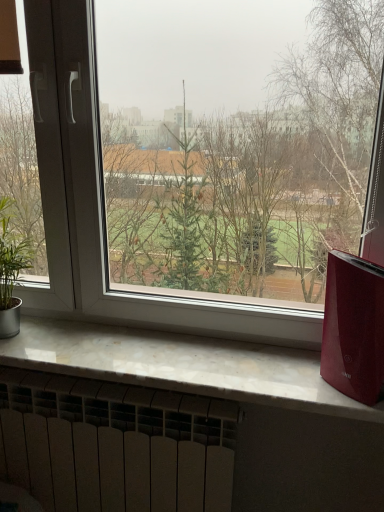
Question: Considering the positions of transparent glass window at center and green leafy plant at left in the image, is transparent glass window at center taller or shorter than green leafy plant at left?

Choices:
 (A) tall
 (B) short

Answer: (A)

Question: In terms of size, does transparent glass window at center appear bigger or smaller than green leafy plant at left?

Choices:
 (A) small
 (B) big

Answer: (B)

Question: Which is farther from the white marble window sill at lower center?

Choices:
 (A) transparent glass window at center
 (B) green leafy plant at left
 (C) shiny red air purifier at right
 (D) white matte radiator at bottom

Answer: (B)

Question: Which object is positioned closest to the transparent glass window at center?

Choices:
 (A) shiny red air purifier at right
 (B) green leafy plant at left
 (C) white marble window sill at lower center
 (D) white matte radiator at bottom

Answer: (C)